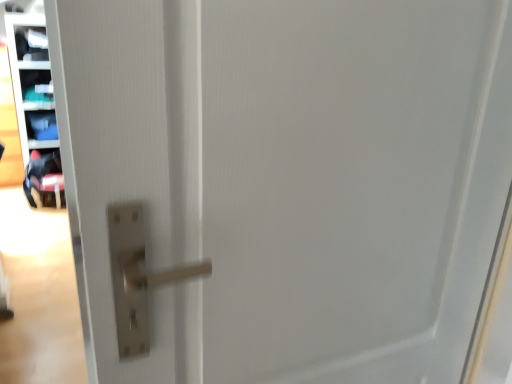
Question: Is matte plastic shelf at upper left, which ranks as the 3th shelf in bottom-to-top order, inside the boundaries of matte plastic shelf at upper left, the fourth shelf ordered from the bottom, or outside?

Choices:
 (A) inside
 (B) outside

Answer: (B)

Question: From a real-world perspective, relative to matte plastic shelf at upper left, the fourth shelf ordered from the bottom, is matte plastic shelf at upper left, which ranks as the 3th shelf in bottom-to-top order, vertically above or below?

Choices:
 (A) above
 (B) below

Answer: (B)

Question: Which of these objects is positioned farthest from the matte plastic shelf at upper left, which is the 2th shelf in bottom-to-top order?

Choices:
 (A) matte plastic shelf at upper left, the 2th shelf viewed from the top
 (B) matte plastic shelf at left, placed as the fourth shelf when sorted from top to bottom
 (C) matte plastic shelf at upper left, the fourth shelf ordered from the bottom

Answer: (C)

Question: Considering the real-world distances, which object is farthest from the matte plastic shelf at left, arranged as the first shelf when ordered from the bottom?

Choices:
 (A) matte plastic shelf at upper left, which ranks as the 3th shelf in bottom-to-top order
 (B) matte plastic shelf at upper left, the third shelf when ordered from top to bottom
 (C) matte plastic shelf at upper left, the first shelf positioned from the top

Answer: (C)